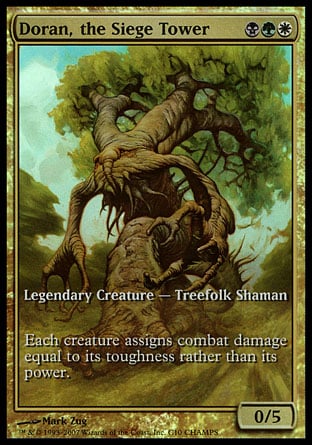
Where is `gold frame`? gold frame is located at coordinates (182, 426).